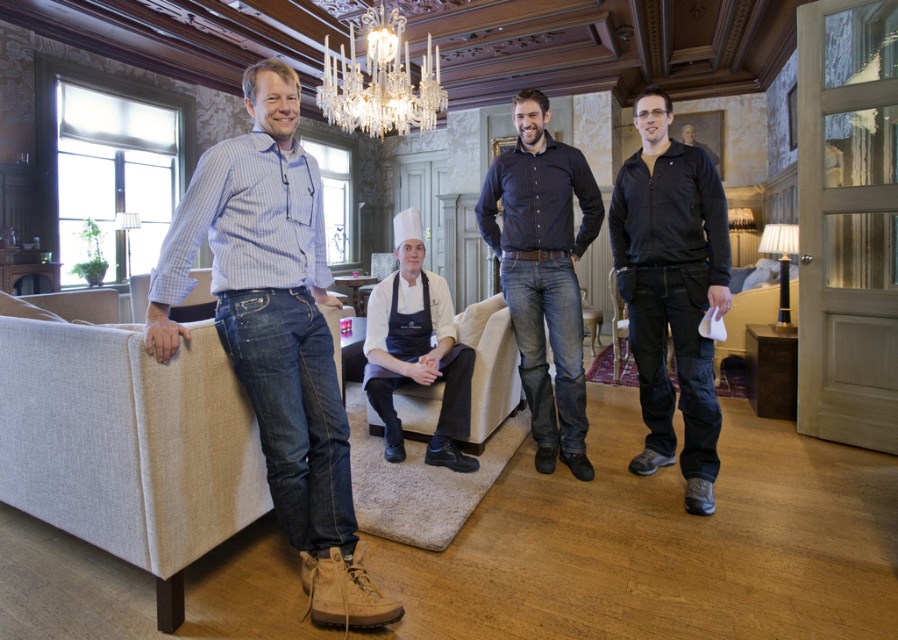
Does textured beige couch at left have a lesser height compared to black fabric armchair at right?

In fact, textured beige couch at left may be taller than black fabric armchair at right.

Does textured beige couch at left have a smaller size compared to black fabric armchair at right?

Incorrect, textured beige couch at left is not smaller in size than black fabric armchair at right.

Is point (16, 337) positioned in front of point (619, 353)?

Yes.

Locate an element on the screen. textured beige couch at left is located at coordinates (125, 436).

Who is shorter, dark blue striped shirt at center or crystal glass chandelier at upper center?

Standing shorter between the two is crystal glass chandelier at upper center.

Can you confirm if dark blue striped shirt at center is bigger than crystal glass chandelier at upper center?

No, dark blue striped shirt at center is not bigger than crystal glass chandelier at upper center.

Who is more forward, (514, 301) or (407, 81)?

Point (514, 301) is more forward.

Locate an element on the screen. The height and width of the screenshot is (640, 898). dark blue striped shirt at center is located at coordinates (543, 273).

Who is taller, black matte jacket at right or crystal glass chandelier at upper center?

Standing taller between the two is black matte jacket at right.

Does point (720, 276) come behind point (401, 106)?

No, (720, 276) is in front of (401, 106).

Between point (680, 154) and point (381, 54), which one is positioned in front?

Point (680, 154) is in front.

Image resolution: width=898 pixels, height=640 pixels. Identify the location of black matte jacket at right. (671, 289).